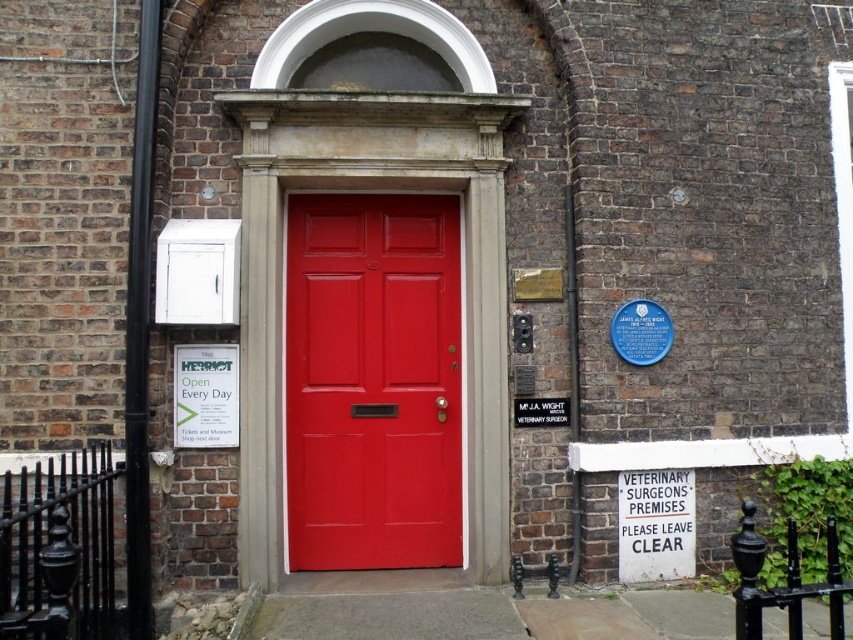
Question: Which point is farther to the camera?

Choices:
 (A) white paper sign at center
 (B) matte red door at center

Answer: (B)

Question: From the image, what is the correct spatial relationship of matte red door at center in relation to white paper sign at center?

Choices:
 (A) left
 (B) right

Answer: (B)

Question: Which object appears closest to the camera in this image?

Choices:
 (A) matte red door at center
 (B) white paper sign at center

Answer: (B)

Question: Which of the following is the closest to the observer?

Choices:
 (A) white paper sign at center
 (B) matte red door at center

Answer: (A)

Question: In this image, where is matte red door at center located relative to white paper sign at center?

Choices:
 (A) above
 (B) below

Answer: (A)

Question: Is matte red door at center to the right of white paper sign at center from the viewer's perspective?

Choices:
 (A) no
 (B) yes

Answer: (B)